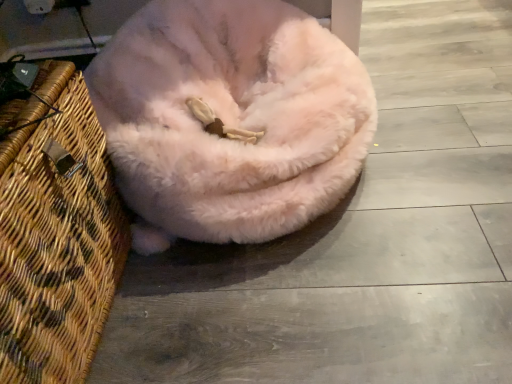
Where is `free location in front of pink fluffy dog bed at center`? Image resolution: width=512 pixels, height=384 pixels. free location in front of pink fluffy dog bed at center is located at coordinates (301, 313).